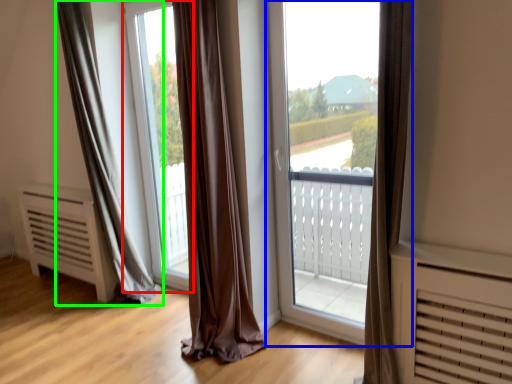
Question: Which is nearer to the window screen (highlighted by a red box)? window (highlighted by a blue box) or curtain (highlighted by a green box).

Choices:
 (A) window
 (B) curtain

Answer: (B)